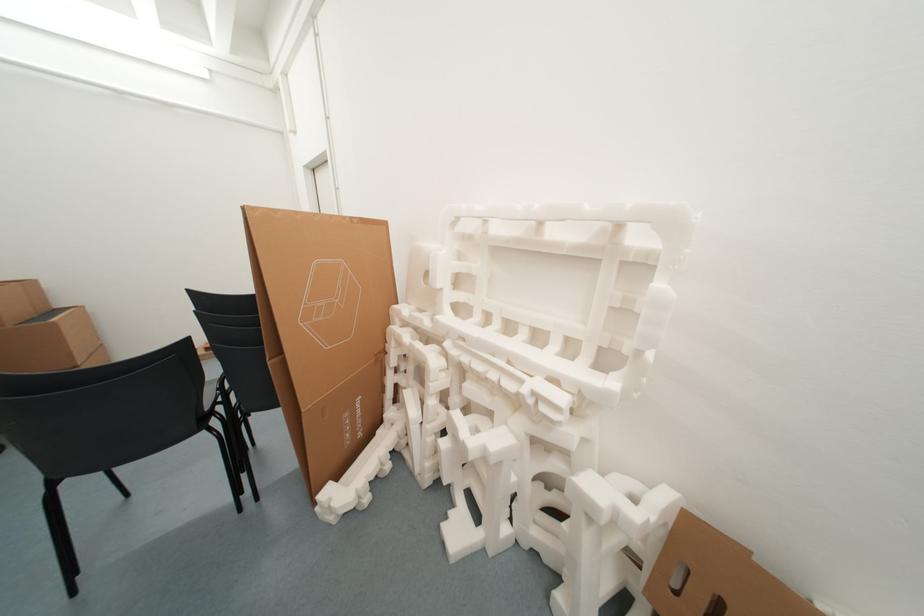
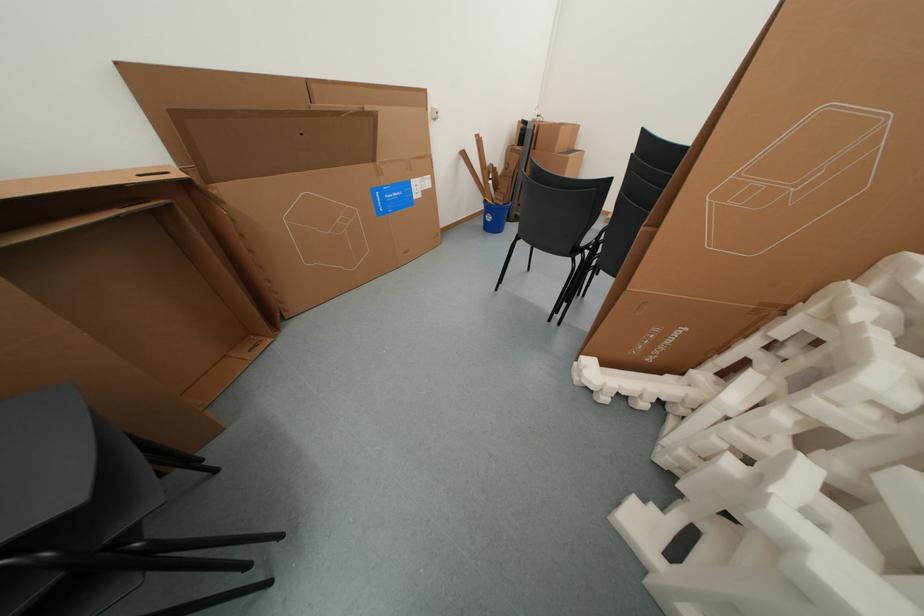
The images are taken continuously from a first-person perspective. In which direction is your viewpoint rotating?

The camera rotated toward left-down.